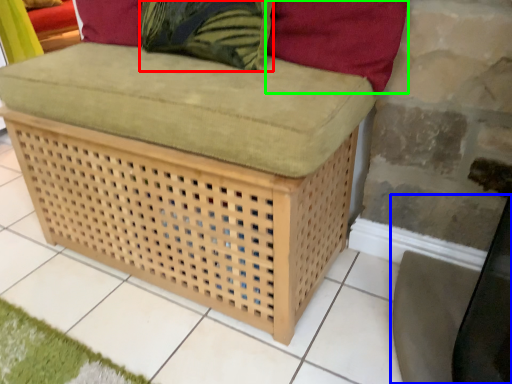
Question: Which is nearer to the throw pillow (highlighted by a red box)? swivel chair (highlighted by a blue box) or pillow (highlighted by a green box).

Choices:
 (A) swivel chair
 (B) pillow

Answer: (B)